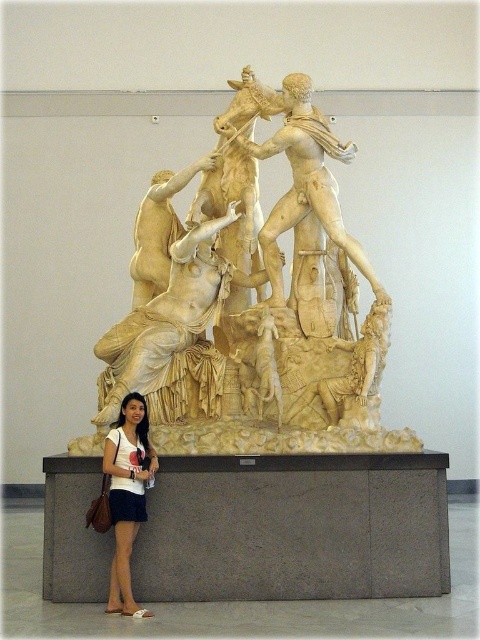
Is point (216, 410) positioned behind point (106, 460)?

Yes.

Locate an element on the screen. white marble sculpture at center is located at coordinates (255, 307).

Does point (283, 218) come behind point (242, 566)?

That is True.

Which is above, white marble sculpture at center or gray concrete base at lower center?

white marble sculpture at center

Is point (277, 380) farther from camera compared to point (352, 504)?

Yes.

Identify the location of white marble sculpture at center. (255, 307).

Is gray concrete base at lower center wider than matte white dress at lower left?

Yes, gray concrete base at lower center is wider than matte white dress at lower left.

Is gray concrete base at lower center taller than matte white dress at lower left?

No, gray concrete base at lower center is not taller than matte white dress at lower left.

Where is `gray concrete base at lower center`? This screenshot has height=640, width=480. gray concrete base at lower center is located at coordinates (295, 528).

At what (x,y) coordinates should I click in order to perform the action: click on gray concrete base at lower center. Please return your answer as a coordinate pair (x, y). The image size is (480, 640). Looking at the image, I should click on (295, 528).